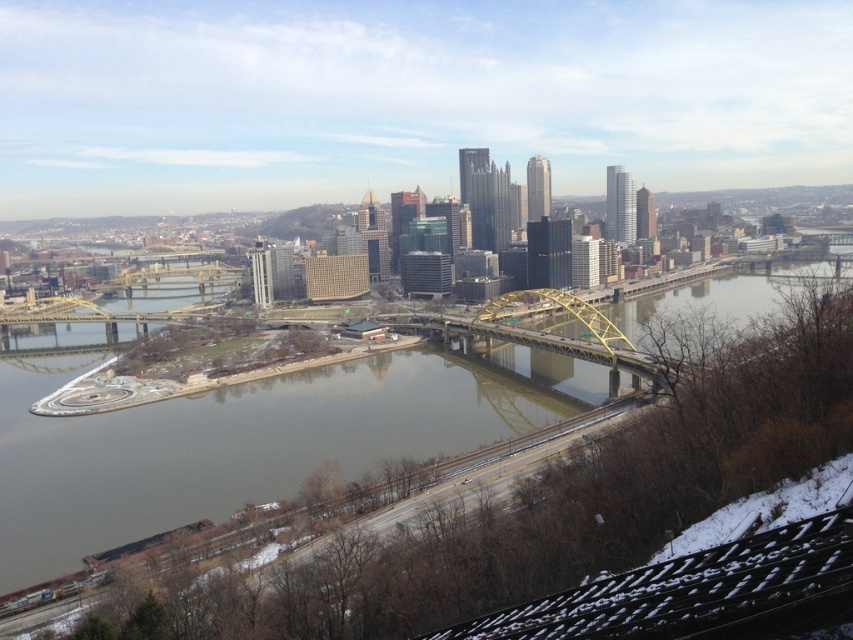
Is greenish-gray water at center to the right of yellow metallic bridge at center from the viewer's perspective?

Correct, you'll find greenish-gray water at center to the right of yellow metallic bridge at center.

Locate an element on the screen. The width and height of the screenshot is (853, 640). greenish-gray water at center is located at coordinates (247, 440).

I want to click on greenish-gray water at center, so click(x=247, y=440).